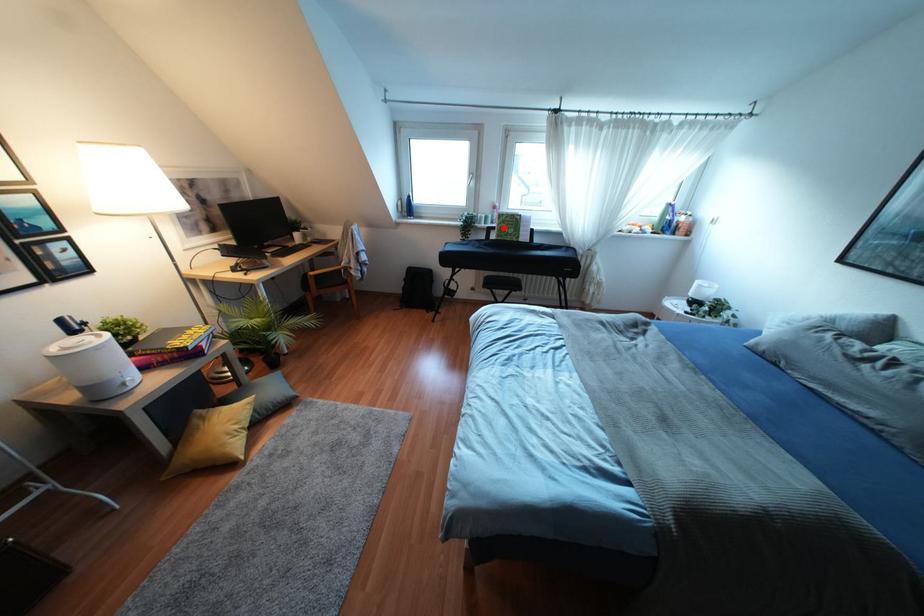
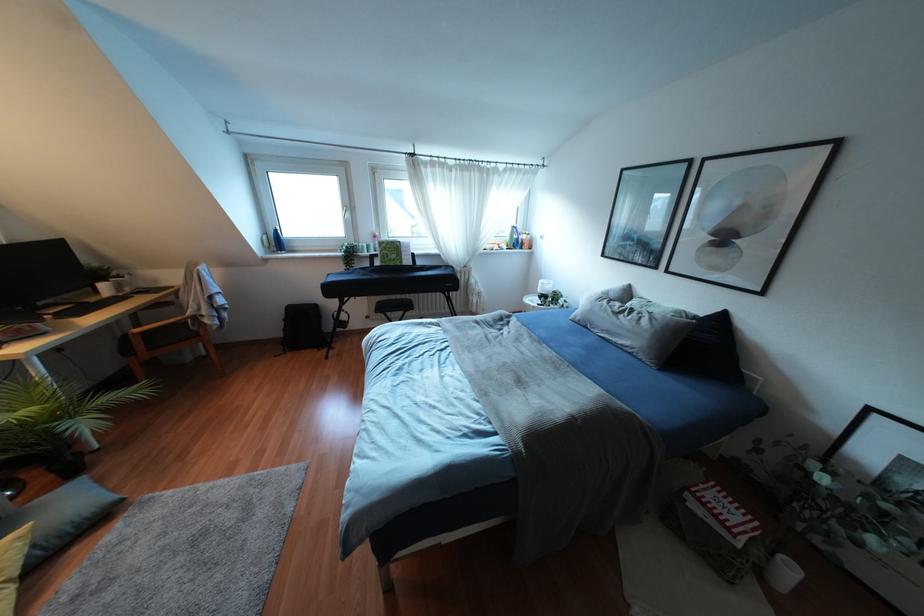
The point at the highlighted location is marked in the first image. Where is the corresponding point in the second image?

(385, 254)